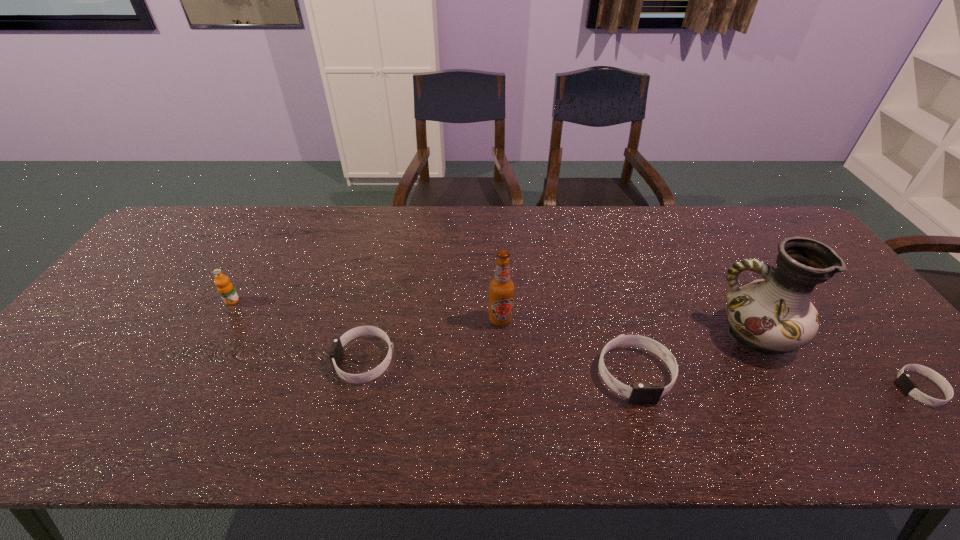
Where is `the fifth tallest object`? the fifth tallest object is located at coordinates (336, 352).

This screenshot has height=540, width=960. I want to click on the leftmost wristband, so tap(336, 352).

The image size is (960, 540). I want to click on the second wristband from left to right, so click(x=640, y=393).

Find the location of `the rightmost wristband`. the rightmost wristband is located at coordinates click(904, 381).

I want to click on the shortest object, so click(x=904, y=381).

Image resolution: width=960 pixels, height=540 pixels. Find the location of `beer bottle`. beer bottle is located at coordinates (501, 287).

Where is `the fourth object from right to left`? the fourth object from right to left is located at coordinates (501, 287).

Locate an element on the screen. The height and width of the screenshot is (540, 960). the farthest object is located at coordinates (230, 297).

This screenshot has height=540, width=960. I want to click on the leftmost object, so click(x=230, y=297).

Locate an element on the screen. the tallest object is located at coordinates (775, 315).